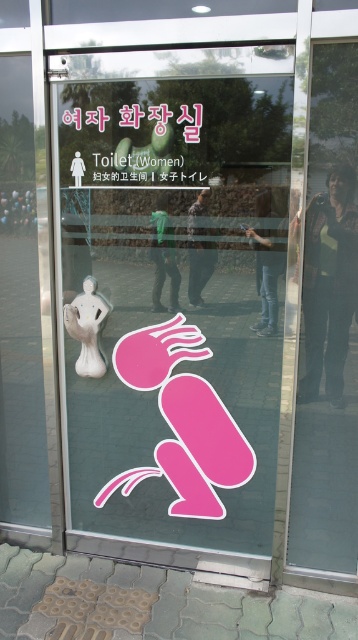
You are standing in front of the glass door of the women restroom. You see two points marked on the door, one at point coordinate (x=318, y=52) and another at point coordinate (x=107, y=310). Which point is closer to you?

Point coordinate (x=318, y=52) is closer to you than point coordinate (x=107, y=310).

You are a delivery person carrying a large box that is 1.2 meters wide. You need to pass through the transparent glass door at right and avoid hitting the white glossy statue at center. Can you fit through the door without damaging the statue?

The transparent glass door at right is wider than the white glossy statue at center. Since your box is 1.2 meters wide, you should check the door width. If the door is wider than 1.2 meters, you can pass. However, the statue is narrower than the door, so avoid it by moving closer to the door frame.

You are a delivery person with a cart that is 1 meter wide. You need to move from the white glossy statue at center to the transparent glass door at right. Can your cart fit through the space between them?

The distance between the transparent glass door at right and the white glossy statue at center is 1.02 meters. Since your cart is 1 meter wide, it can fit through the space between them as the distance is slightly wider than the cart.